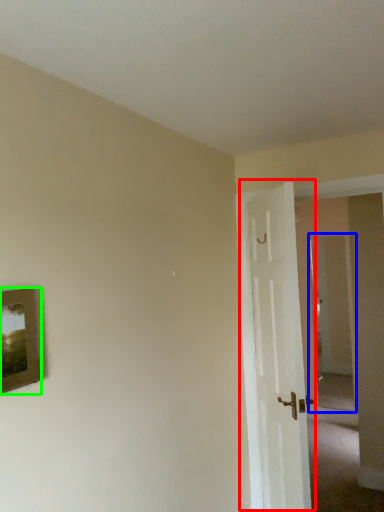
Question: Estimate the real-world distances between objects in this image. Which object is closer to door (highlighted by a red box), glass door (highlighted by a blue box) or picture frame (highlighted by a green box)?

Choices:
 (A) glass door
 (B) picture frame

Answer: (B)